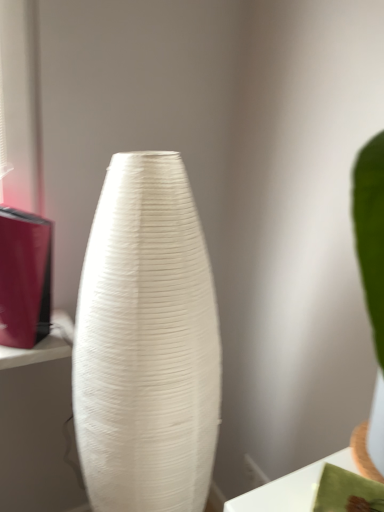
You are a GUI agent. You are given a task and a screenshot of the screen. Output one action in this format:
    pyautogui.click(x=<x>, y=<y>)
    Task: Click on the white textured vase at center
    
    Given the screenshot: What is the action you would take?
    pyautogui.click(x=146, y=343)

Based on the photo, measure the distance between point [73,375] and camera.

Point [73,375] is 38.19 inches from camera.

The height and width of the screenshot is (512, 384). What do you see at coordinates (146, 343) in the screenshot? I see `white textured vase at center` at bounding box center [146, 343].

What is the approximate height of white textured vase at center?

white textured vase at center is 3.68 feet tall.

Measure the distance between point (269,490) and camera.

The depth of point (269,490) is 22.80 inches.

The height and width of the screenshot is (512, 384). What do you see at coordinates (290, 488) in the screenshot?
I see `white glossy table at lower right` at bounding box center [290, 488].

At what (x,y) coordinates should I click in order to perform the action: click on white glossy table at lower right. Please return your answer as a coordinate pair (x, y). Looking at the image, I should click on (290, 488).

Locate an element on the screen. white textured vase at center is located at coordinates (146, 343).

Considering the positions of objects white glossy table at lower right and white textured vase at center in the image provided, who is more to the right, white glossy table at lower right or white textured vase at center?

Positioned to the right is white glossy table at lower right.

Relative to white textured vase at center, is white glossy table at lower right in front or behind?

white glossy table at lower right is positioned closer to the viewer than white textured vase at center.

Considering the positions of point (347, 460) and point (159, 422), is point (347, 460) closer or farther from the camera than point (159, 422)?

Point (347, 460) appears to be farther away from the viewer than point (159, 422).

From the image's perspective, which is above, white glossy table at lower right or white textured vase at center?

white glossy table at lower right, from the image's perspective.

From a real-world perspective, relative to white textured vase at center, is white glossy table at lower right vertically above or below?

From a real-world perspective, white glossy table at lower right is physically above white textured vase at center.

Can you confirm if white glossy table at lower right is thinner than white textured vase at center?

Yes.

Between white glossy table at lower right and white textured vase at center, which one has less height?

white glossy table at lower right.

Considering the sizes of objects white glossy table at lower right and white textured vase at center in the image provided, who is bigger, white glossy table at lower right or white textured vase at center?

With larger size is white textured vase at center.

Would you say white textured vase at center is part of white glossy table at lower right's contents?

Actually, white textured vase at center is outside white glossy table at lower right.

Are white glossy table at lower right and white textured vase at center beside each other?

No, white glossy table at lower right is not making contact with white textured vase at center.

Is white glossy table at lower right looking in the opposite direction of white textured vase at center?

No, white glossy table at lower right's orientation is not away from white textured vase at center.

What's the angular difference between white glossy table at lower right and white textured vase at center's facing directions?

The facing directions of white glossy table at lower right and white textured vase at center are 29.5 degrees apart.

Where is `table lying above the white textured vase at center (from the image's perspective)`? This screenshot has height=512, width=384. table lying above the white textured vase at center (from the image's perspective) is located at coordinates (290, 488).

In the image, is white textured vase at center on the left side or the right side of white glossy table at lower right?

Clearly, white textured vase at center is on the left of white glossy table at lower right in the image.

Is white textured vase at center positioned before white glossy table at lower right?

That is False.

Which is nearer, (160, 476) or (286, 492)?

Point (160, 476) is farther from the camera than point (286, 492).

In the scene shown: From the image's perspective, who appears lower, white textured vase at center or white glossy table at lower right?

white textured vase at center appears lower in the image.

From a real-world perspective, is white textured vase at center on top of white glossy table at lower right?

No, from a real-world perspective, white textured vase at center is not on top of white glossy table at lower right.

Considering the relative sizes of white textured vase at center and white glossy table at lower right in the image provided, is white textured vase at center thinner than white glossy table at lower right?

Incorrect, the width of white textured vase at center is not less than that of white glossy table at lower right.

Based on the photo, which of these two, white textured vase at center or white glossy table at lower right, stands shorter?

white glossy table at lower right.

Considering the sizes of objects white textured vase at center and white glossy table at lower right in the image provided, who is smaller, white textured vase at center or white glossy table at lower right?

With smaller size is white glossy table at lower right.

Consider the image. Would you say white textured vase at center contains white glossy table at lower right?

No, white glossy table at lower right is not a part of white textured vase at center.

Is white textured vase at center with white glossy table at lower right?

No, white textured vase at center is not beside white glossy table at lower right.

Does white textured vase at center turn towards white glossy table at lower right?

No, white textured vase at center is not turned towards white glossy table at lower right.

Can you tell me how much white textured vase at center and white glossy table at lower right differ in facing direction?

The angular difference between white textured vase at center and white glossy table at lower right is 29.5 degrees.

How much distance is there between white textured vase at center and white glossy table at lower right?

white textured vase at center is 12.53 inches from white glossy table at lower right.

Image resolution: width=384 pixels, height=512 pixels. I want to click on vase on the left of white glossy table at lower right, so click(x=146, y=343).

Identify the location of table located above the white textured vase at center (from a real-world perspective). (290, 488).

Locate an element on the screen. vase behind the white glossy table at lower right is located at coordinates (146, 343).